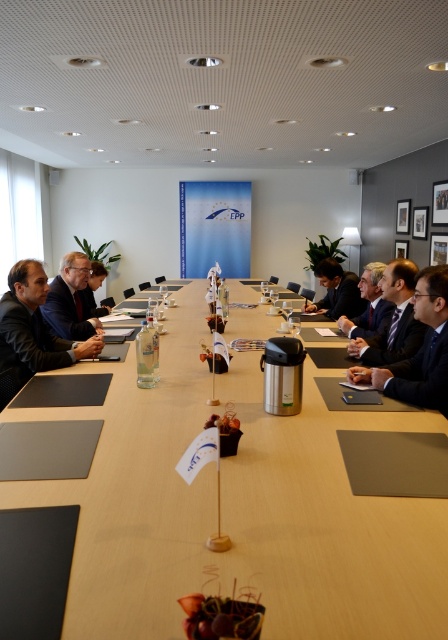
Between wooden table at center and matte black suit at center, which one has more height?

Standing taller between the two is matte black suit at center.

Based on the photo, can you confirm if wooden table at center is taller than matte black suit at center?

No.

Locate an element on the screen. The height and width of the screenshot is (640, 448). wooden table at center is located at coordinates (240, 509).

Is matte black suit at left closer to camera compared to matte black suit at center?

Yes, matte black suit at left is in front of matte black suit at center.

Find the location of a particular element. The image size is (448, 640). matte black suit at left is located at coordinates (31, 332).

Which is behind, point (35, 292) or point (81, 308)?

The point (81, 308) is more distant.

Find the location of a particular element. This screenshot has width=448, height=640. matte black suit at left is located at coordinates (31, 332).

Does matte black suit at left have a larger size compared to dark blue suit at center?

Yes.

Is point (30, 268) positioned after point (362, 339)?

No, (30, 268) is closer to viewer.

Is point (17, 353) positioned after point (393, 266)?

No, it is not.

At what (x,y) coordinates should I click in order to perform the action: click on matte black suit at left. Please return your answer as a coordinate pair (x, y). The height and width of the screenshot is (640, 448). Looking at the image, I should click on (31, 332).